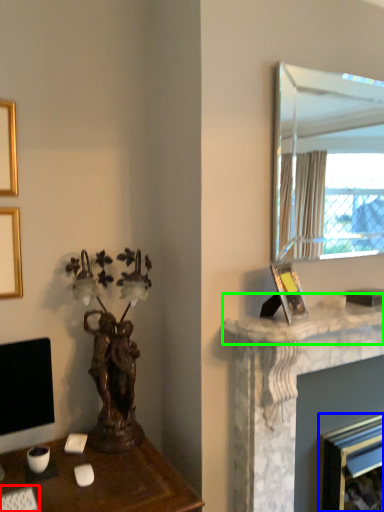
Question: Based on their relative distances, which object is farther from computer keyboard (highlighted by a red box)? Choose from fireplace (highlighted by a blue box) and counter top (highlighted by a green box).

Choices:
 (A) fireplace
 (B) counter top

Answer: (A)